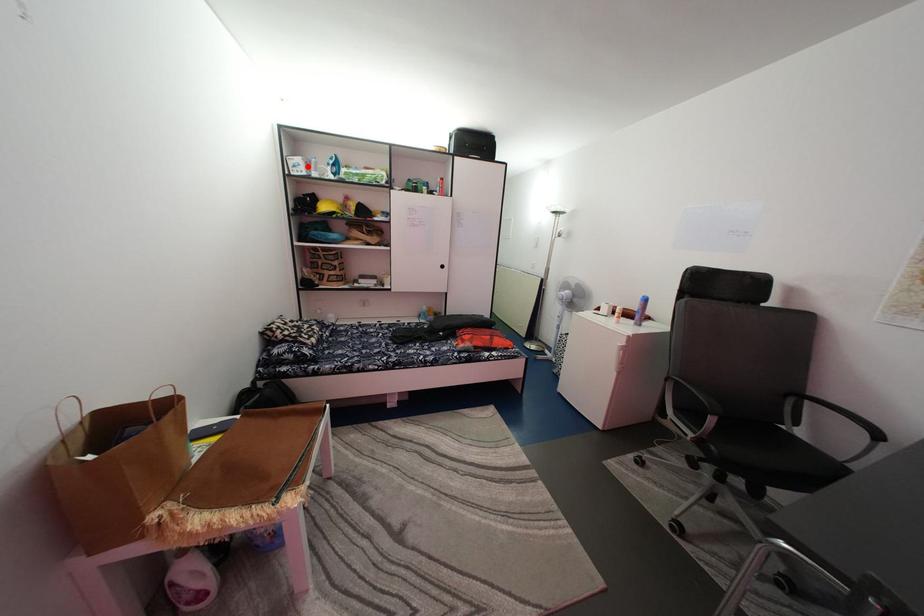
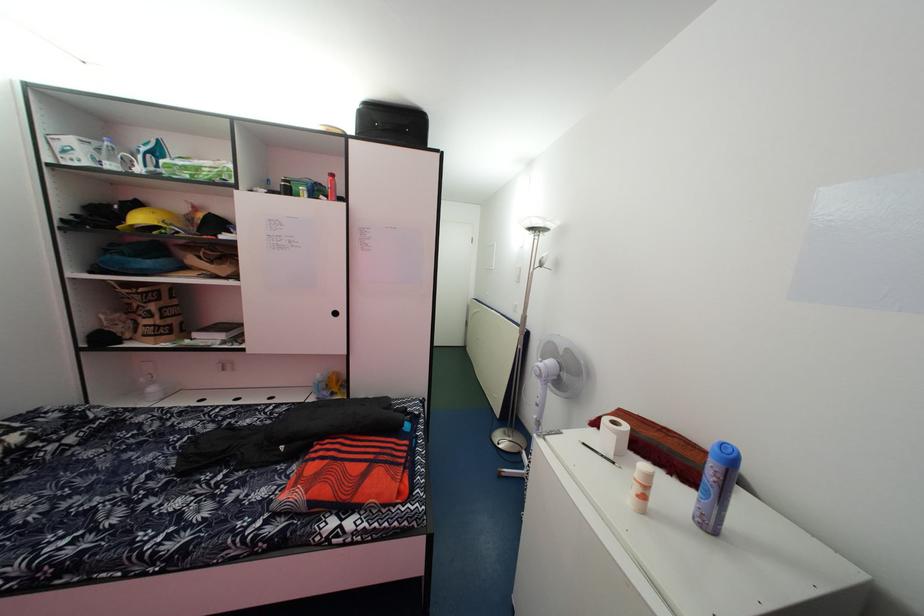
Locate, in the second image, the point that corresponds to the highlighted location in the first image.

(79, 148)